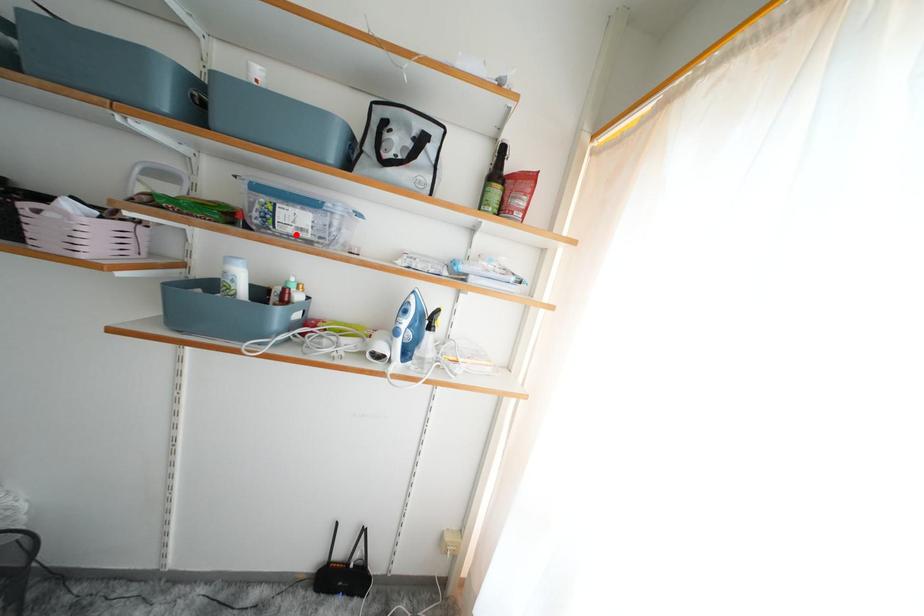
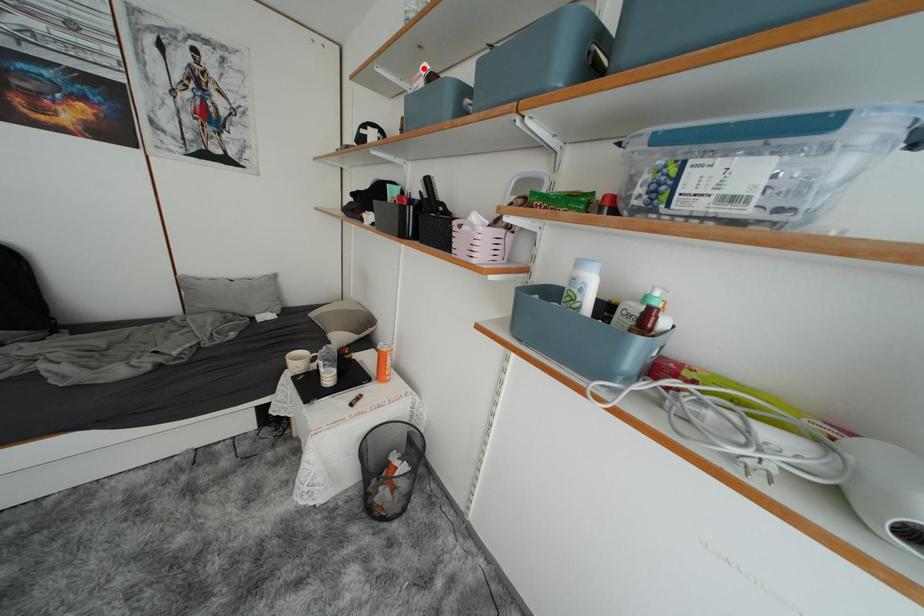
I am providing you with two images of the same scene from different viewpoints. A red point is marked on the first image and another point is marked on the second image. Does the point marked in image1 correspond to the same location as the one in image2?

No